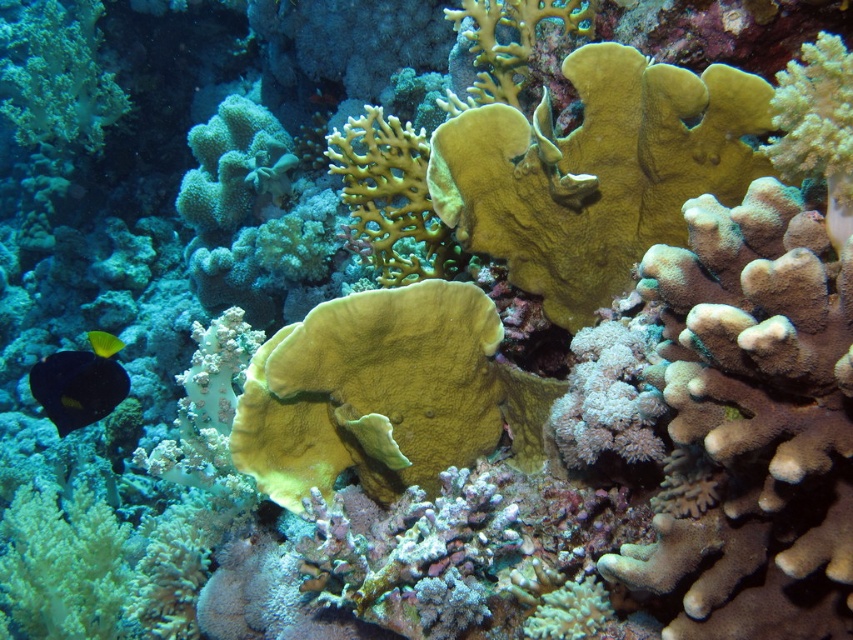
Question: Can you confirm if shiny black fish at lower left is positioned below shiny yellow fish at lower left?

Choices:
 (A) yes
 (B) no

Answer: (A)

Question: Which object appears closest to the camera in this image?

Choices:
 (A) shiny black fish at lower left
 (B) shiny yellow fish at lower left

Answer: (B)

Question: Does shiny black fish at lower left appear over shiny yellow fish at lower left?

Choices:
 (A) no
 (B) yes

Answer: (A)

Question: Which object is closer to the camera taking this photo?

Choices:
 (A) shiny yellow fish at lower left
 (B) shiny black fish at lower left

Answer: (A)

Question: Is shiny black fish at lower left below shiny yellow fish at lower left?

Choices:
 (A) no
 (B) yes

Answer: (B)

Question: Among these points, which one is farthest from the camera?

Choices:
 (A) (88, 340)
 (B) (97, 346)

Answer: (A)